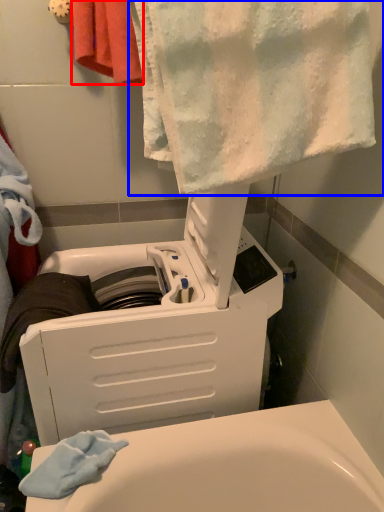
Question: Among these objects, which one is farthest to the camera, towel (highlighted by a red box) or towel (highlighted by a blue box)?

Choices:
 (A) towel
 (B) towel

Answer: (A)